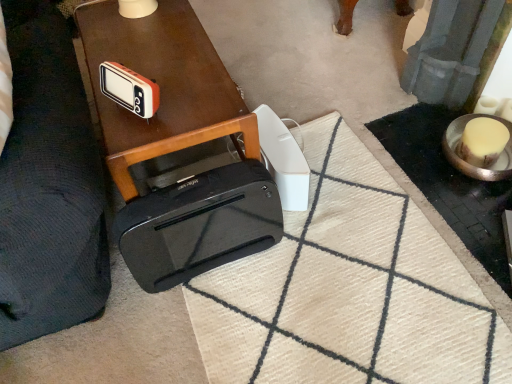
Locate an element on the screen. empty space that is ontop of beige textured doormat at center (from a real-world perspective) is located at coordinates (332, 271).